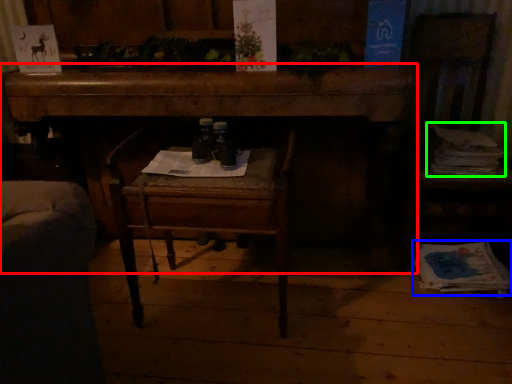
Question: Which object is positioned closest to desk (highlighted by a red box)? Select from magazine (highlighted by a blue box) and magazine (highlighted by a green box).

Choices:
 (A) magazine
 (B) magazine

Answer: (B)